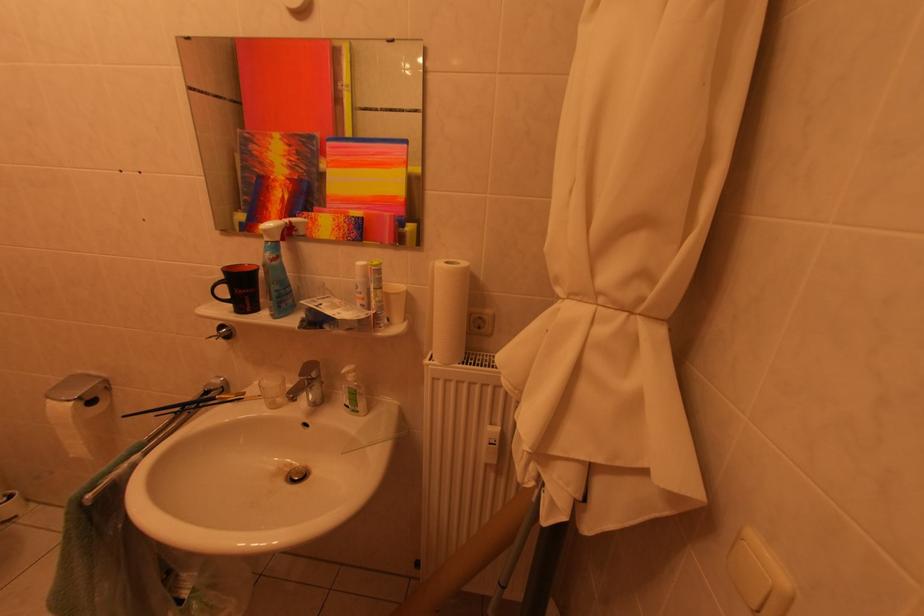
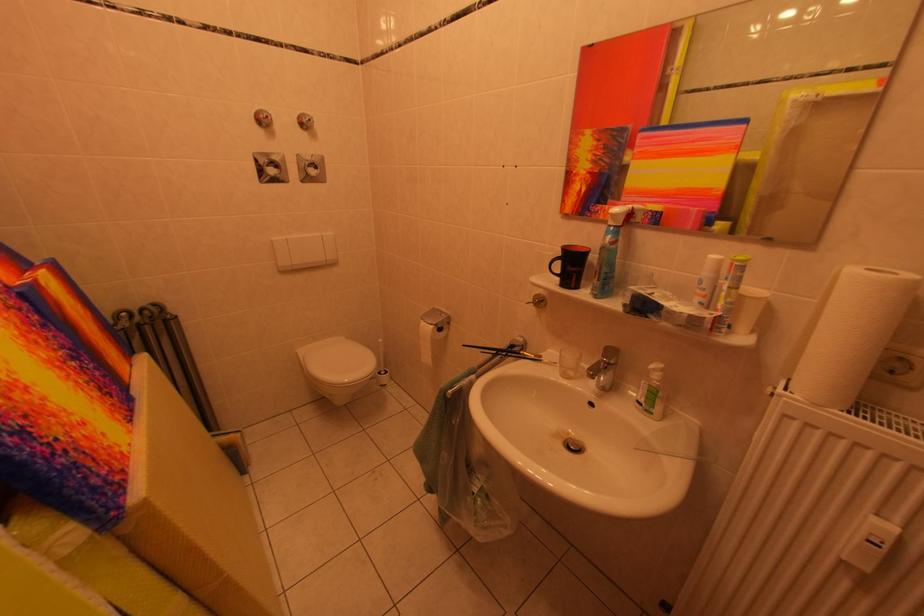
In the second image, find the point that corresponds to (x=268, y=400) in the first image.

(563, 367)